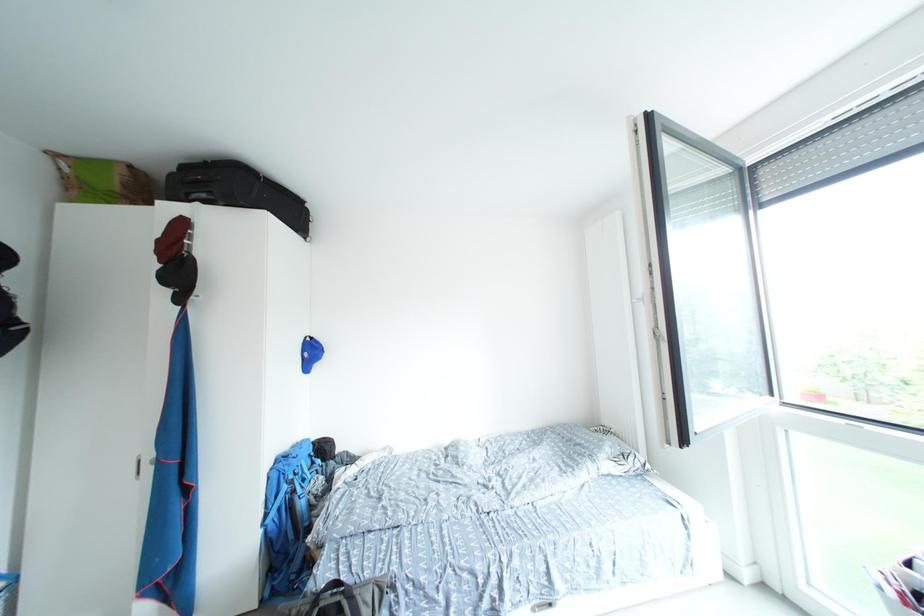
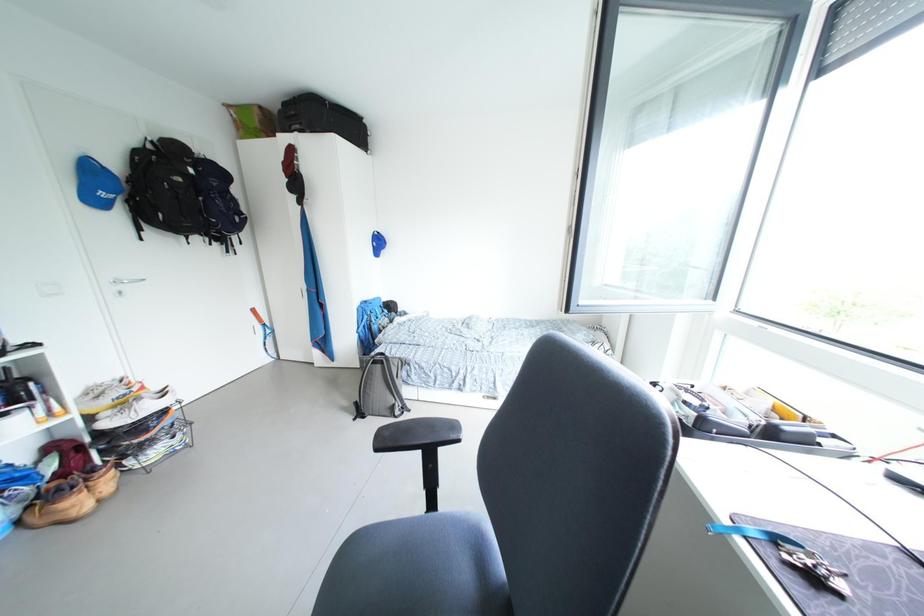
First-person continuous shooting, in which direction is the camera rotating?

The camera rotated toward left-down.